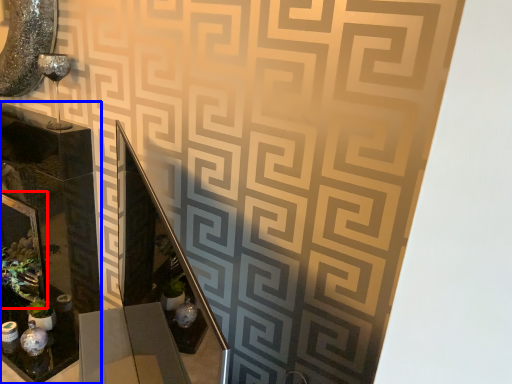
Question: Among these objects, which one is nearest to the camera, picture frame (highlighted by a red box) or glass box (highlighted by a blue box)?

Choices:
 (A) picture frame
 (B) glass box

Answer: (B)